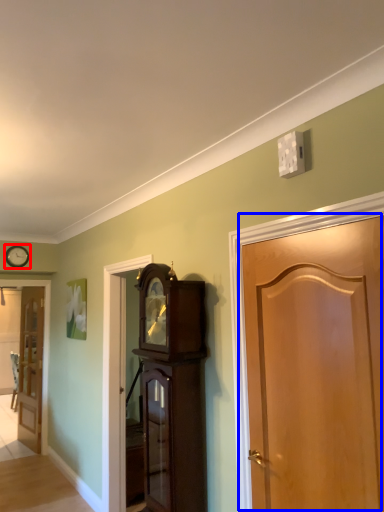
Question: Which object is closer to the camera taking this photo, clock (highlighted by a red box) or door (highlighted by a blue box)?

Choices:
 (A) clock
 (B) door

Answer: (B)